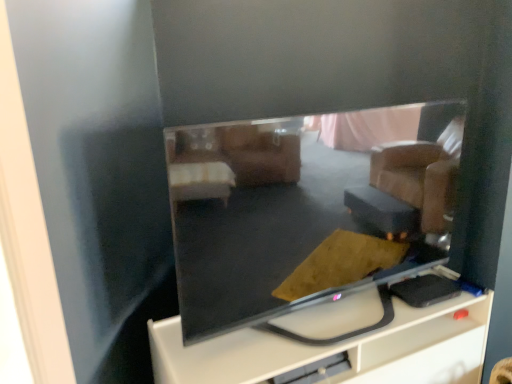
Find the location of `empty space that is ontop of matte black tv at center (from a real-world perspective)`. empty space that is ontop of matte black tv at center (from a real-world perspective) is located at coordinates (338, 321).